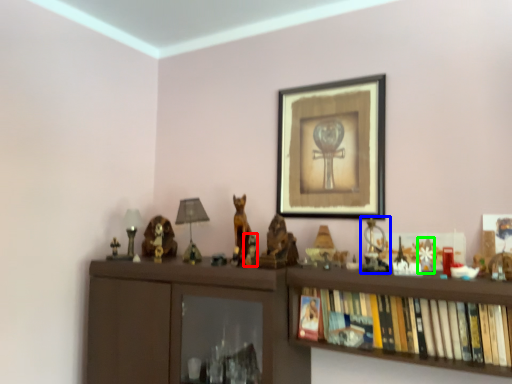
Question: Based on their relative distances, which object is nearer to toy (highlighted by a red box)? Choose from toy (highlighted by a blue box) and toy (highlighted by a green box).

Choices:
 (A) toy
 (B) toy

Answer: (A)